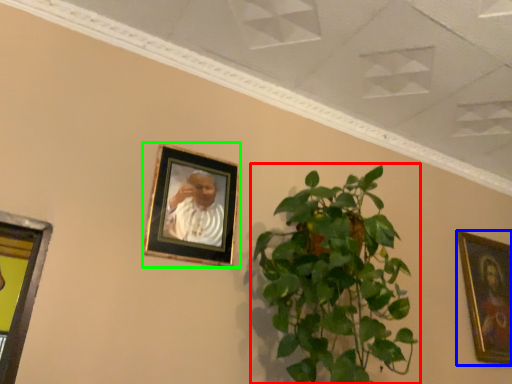
Question: Which is farther away from houseplant (highlighted by a red box)? picture frame (highlighted by a blue box) or picture frame (highlighted by a green box)?

Choices:
 (A) picture frame
 (B) picture frame

Answer: (A)